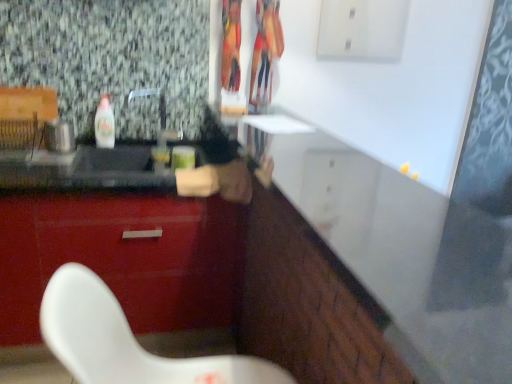
The height and width of the screenshot is (384, 512). I want to click on vacant space to the right of clear plastic bottle at left, so click(133, 148).